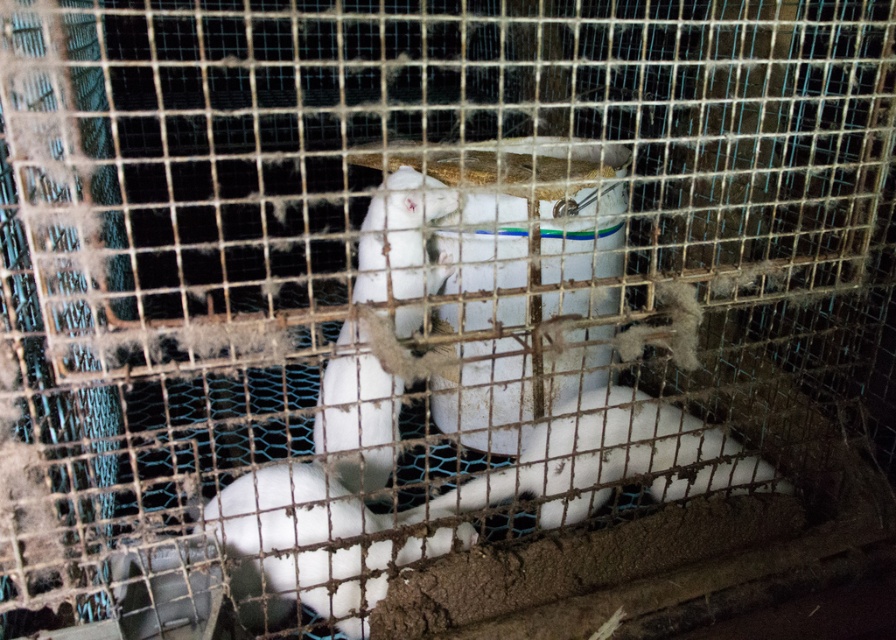
You are a veterinarian examining two rabbits in a cage. You notice the white fluffy rabbit at center and the white fur animal at center. Which rabbit is taller?

The white fur animal at center is taller than the white fluffy rabbit at center.

You are a small toy mouse that is 5 centimeters long. You want to move from the white fluffy rabbit at center to the white fur animal at center. Can you fit through the space between them?

The distance between the white fluffy rabbit at center and the white fur animal at center is 21.26 centimeters. Since the toy mouse is only 5 centimeters long, it can easily move through the space between them.

You are a veterinarian examining two rabbits in a cage. You notice a white fur rabbit at center and a white fluffy rabbit at center. Which rabbit appears taller?

The white fluffy rabbit at center is taller than the white fur rabbit at center.